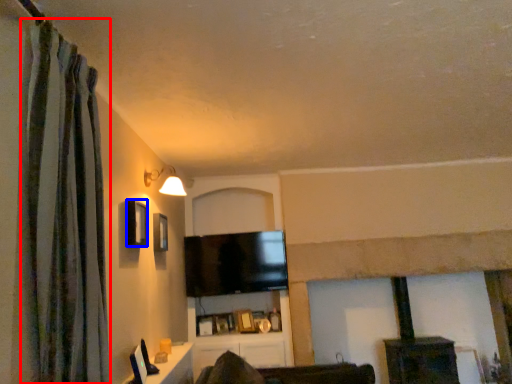
Question: Which of the following is the closest to the observer, curtain (highlighted by a red box) or window (highlighted by a blue box)?

Choices:
 (A) curtain
 (B) window

Answer: (A)